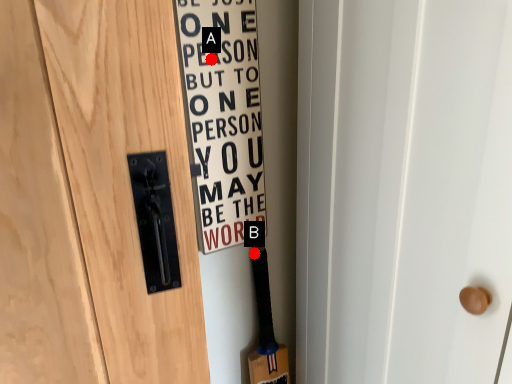
Question: Two points are circled on the image, labeled by A and B beside each circle. Among these points, which one is nearest to the camera?

Choices:
 (A) A is closer
 (B) B is closer

Answer: (A)